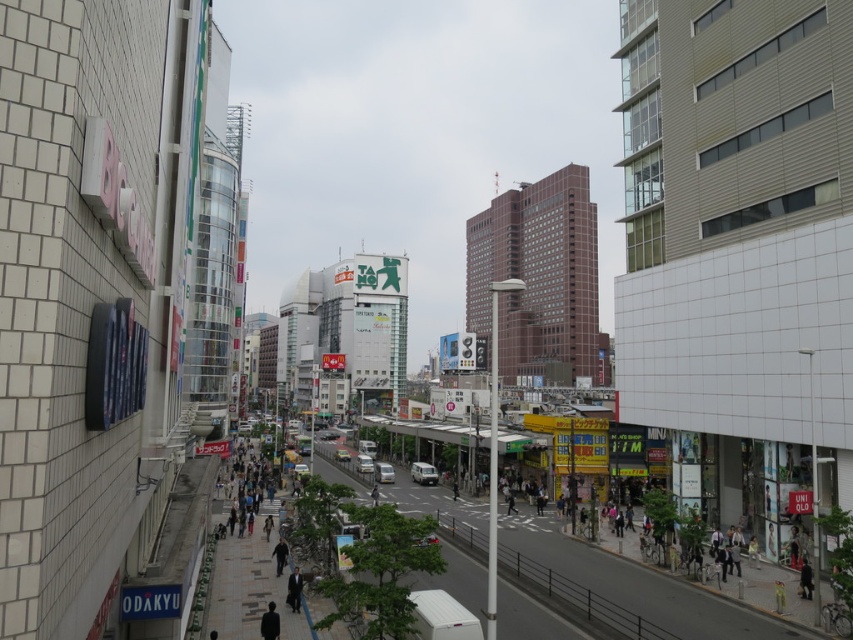
How distant is dark gray suit at lower center from dark gray suit at center?

A distance of 4.94 meters exists between dark gray suit at lower center and dark gray suit at center.

The width and height of the screenshot is (853, 640). Describe the element at coordinates (270, 621) in the screenshot. I see `dark gray suit at lower center` at that location.

Is point (270, 608) positioned before point (289, 602)?

Yes, point (270, 608) is in front of point (289, 602).

The image size is (853, 640). I want to click on dark gray suit at lower center, so click(270, 621).